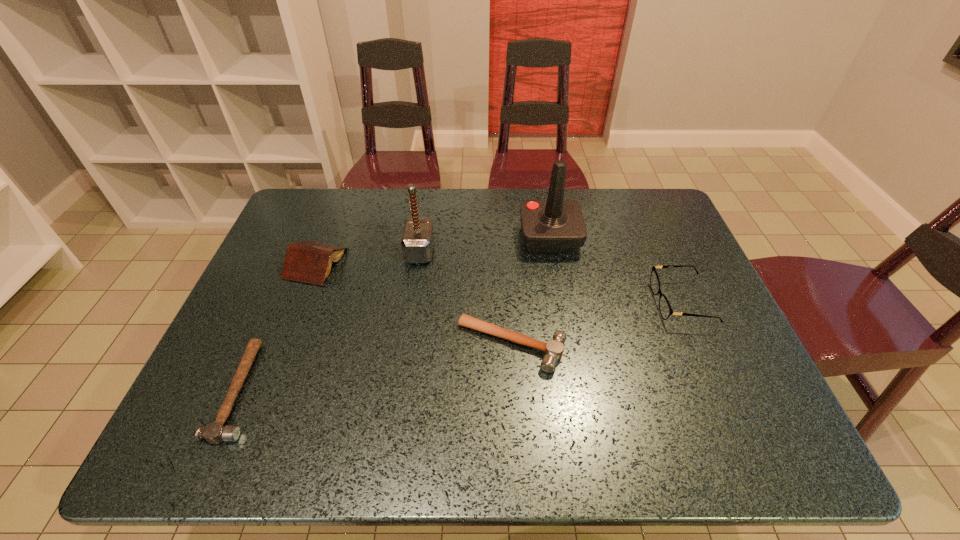
Locate an element on the screen. joystick is located at coordinates (554, 225).

This screenshot has width=960, height=540. I want to click on the fourth object from right to left, so click(417, 240).

Where is `the farthest hammer`? the farthest hammer is located at coordinates (417, 240).

Locate an element on the screen. book is located at coordinates (309, 261).

This screenshot has height=540, width=960. Identify the location of spectacles. click(x=665, y=309).

Locate an element on the screen. The width and height of the screenshot is (960, 540). the rightmost hammer is located at coordinates (553, 349).

Identify the location of the shortest object. This screenshot has height=540, width=960. (214, 433).

This screenshot has width=960, height=540. What are the coordinates of `the shortest hammer` in the screenshot? It's located at (214, 433).

The width and height of the screenshot is (960, 540). I want to click on free spot located 0.190m on the right of the joystick, so click(642, 237).

The height and width of the screenshot is (540, 960). Find the location of `free region located 0.090m on the front of the farthest hammer`. free region located 0.090m on the front of the farthest hammer is located at coordinates (414, 289).